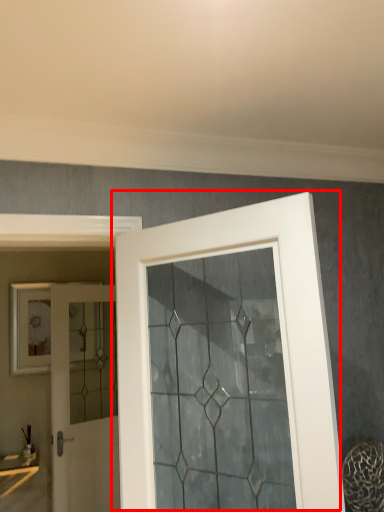
Question: From the image, what is the correct spatial relationship of door (annotated by the red box) in relation to door?

Choices:
 (A) left
 (B) right

Answer: (B)